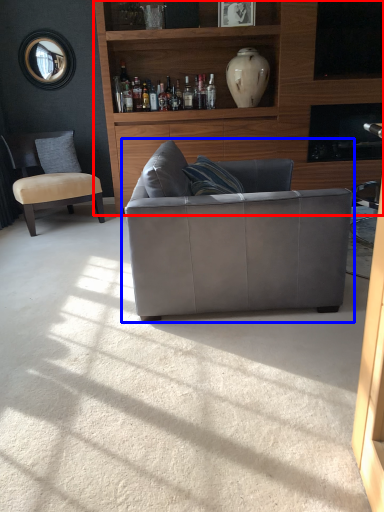
Question: Among these objects, which one is nearest to the camera, entertainment center (highlighted by a red box) or studio couch (highlighted by a blue box)?

Choices:
 (A) entertainment center
 (B) studio couch

Answer: (B)